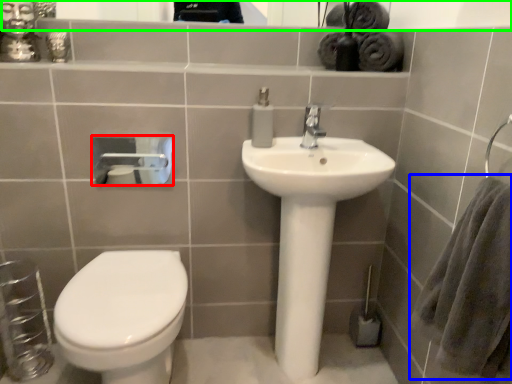
Question: Based on their relative distances, which object is nearer to toilet paper (highlighted by a red box)? Choose from bath towel (highlighted by a blue box) and mirror (highlighted by a green box).

Choices:
 (A) bath towel
 (B) mirror

Answer: (B)